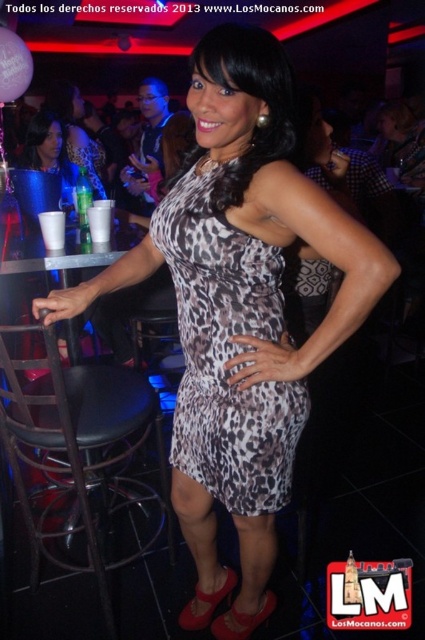
Is leopard print dress at center smaller than matte black dress at upper left?

Yes.

Is leopard print dress at center bigger than matte black dress at upper left?

Incorrect, leopard print dress at center is not larger than matte black dress at upper left.

Measure the distance between point (286,436) and camera.

Point (286,436) and camera are 4.07 feet apart from each other.

At what (x,y) coordinates should I click in order to perform the action: click on leopard print dress at center. Please return your answer as a coordinate pair (x, y). Looking at the image, I should click on (226, 352).